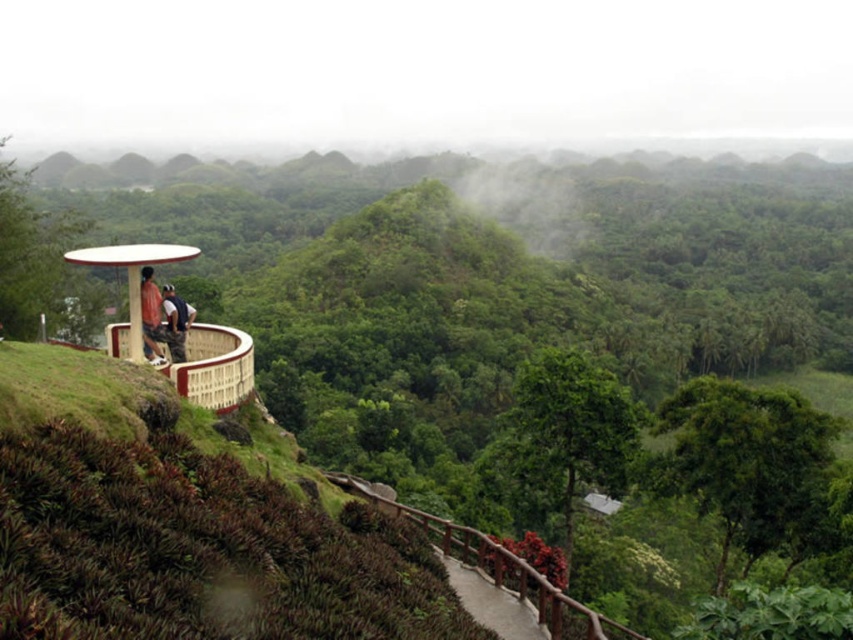
You are a tour guide leading a group to the observation platform. You notice the concrete wooden railing at lower center and the matte red shirt at center. Which object is smaller in size?

The concrete wooden railing at lower center is smaller in size compared to the matte red shirt at center according to the description.

You are standing at the scenic overlook point in Bohol, Philippines, and you want to reach the circular observation platform. There is a curved pathway bordered by the concrete wooden railing at lower center. Which direction should you walk relative to the railing to reach the platform?

To reach the circular observation platform, you should walk towards the direction where the curved pathway leads away from the concrete wooden railing at lower center. Since the railing is at the lower center, moving forward along the pathway towards the upper area would bring you to the platform.

You are a tourist visiting the Chocolate Hills and want to take a photo of the dark blue shirt at upper center from behind the concrete wooden railing at lower center. Will the railing block your view of the shirt?

The concrete wooden railing at lower center is shorter than the dark blue shirt at upper center, so the railing will not block your view of the shirt.